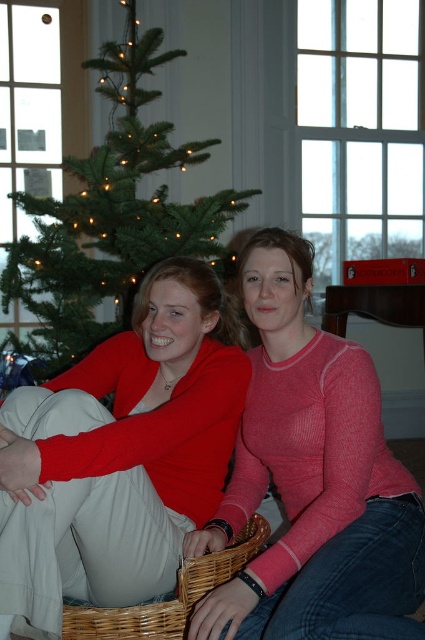
Is pink ribbed sweater at center smaller than woven brown basket at lower center?

No, pink ribbed sweater at center is not smaller than woven brown basket at lower center.

Is point (291, 486) farther from camera compared to point (221, 577)?

Yes, it is.

Identify the location of pink ribbed sweater at center. The width and height of the screenshot is (425, 640). (311, 480).

Does green matte christmas tree at center lie behind woven brown basket at lower center?

Yes, green matte christmas tree at center is further from the viewer.

Between point (161, 141) and point (189, 570), which one is positioned behind?

Positioned behind is point (161, 141).

Describe the element at coordinates (110, 218) in the screenshot. I see `green matte christmas tree at center` at that location.

At what (x,y) coordinates should I click in order to perform the action: click on green matte christmas tree at center. Please return your answer as a coordinate pair (x, y). Looking at the image, I should click on (110, 218).

Describe the element at coordinates (121, 452) in the screenshot. I see `matte red sweater at center` at that location.

Which is above, matte red sweater at center or woven brown basket at lower center?

Positioned higher is matte red sweater at center.

Image resolution: width=425 pixels, height=640 pixels. Describe the element at coordinates (121, 452) in the screenshot. I see `matte red sweater at center` at that location.

This screenshot has height=640, width=425. What are the coordinates of `matte red sweater at center` in the screenshot? It's located at (121, 452).